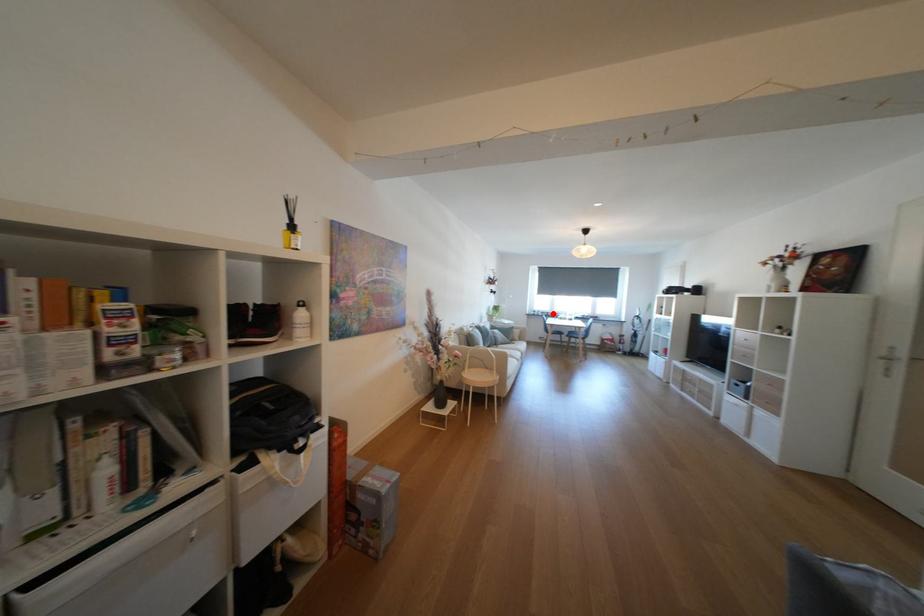
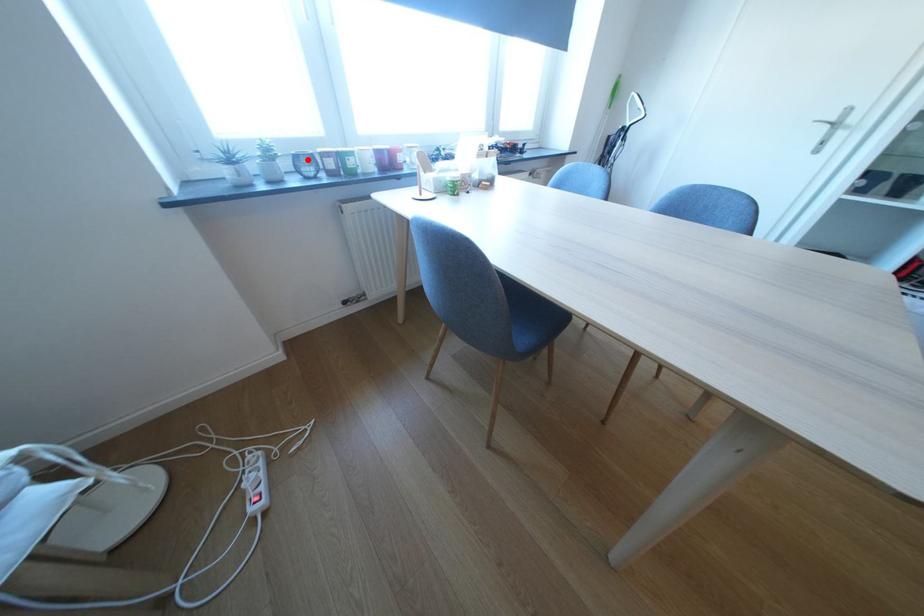
I am providing you with two images of the same scene from different viewpoints. A red point is marked on the first image and another point is marked on the second image. Are the points marked in image1 and image2 representing the same 3D position?

Yes